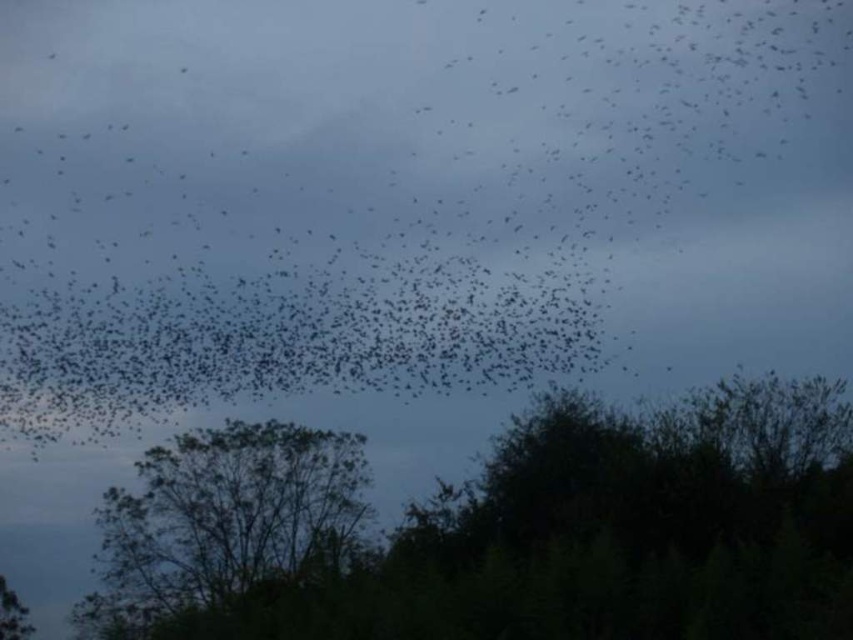
Question: Which point is closer to the camera?

Choices:
 (A) green leafy tree at center
 (B) black matte birds at upper center
 (C) green leafy tree at lower center

Answer: (C)

Question: Does green leafy tree at lower center have a larger size compared to green leafy tree at center?

Choices:
 (A) no
 (B) yes

Answer: (B)

Question: Does black matte birds at upper center appear on the left side of green leafy tree at center?

Choices:
 (A) no
 (B) yes

Answer: (A)

Question: Is black matte birds at upper center bigger than green leafy tree at lower center?

Choices:
 (A) yes
 (B) no

Answer: (B)

Question: Which point is farther from the camera taking this photo?

Choices:
 (A) click(x=799, y=632)
 (B) click(x=241, y=433)
 (C) click(x=523, y=77)

Answer: (C)

Question: Which point is farther to the camera?

Choices:
 (A) black matte birds at upper center
 (B) green leafy tree at lower center

Answer: (A)